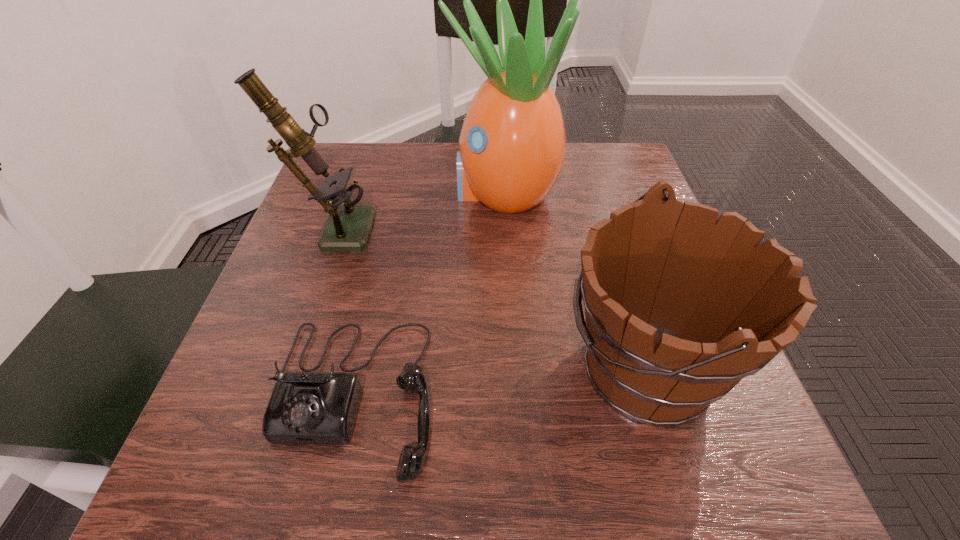
Find the location of a particular element. free spot at the near edge of the desktop is located at coordinates pyautogui.click(x=574, y=458).

In the image, there is a desktop. Identify the location of free region at the left edge. (294, 289).

Identify the location of free space at the right edge of the desktop. click(579, 204).

Find the location of a particular element. The width and height of the screenshot is (960, 540). vacant space at the far left corner of the desktop is located at coordinates (368, 154).

In the image, there is a desktop. What are the coordinates of `free space at the far right corner` in the screenshot? It's located at (645, 191).

You are a GUI agent. You are given a task and a screenshot of the screen. Output one action in this format:
    pyautogui.click(x=<x>, y=<y>)
    Task: Click on the vacant space at the near right corner
    This screenshot has height=540, width=960.
    Given the screenshot: What is the action you would take?
    pyautogui.click(x=718, y=447)

Find the location of `vacant space that is in between the shortest object and the tallest object`. vacant space that is in between the shortest object and the tallest object is located at coordinates (428, 294).

You are a GUI agent. You are given a task and a screenshot of the screen. Output one action in this format:
    pyautogui.click(x=<x>, y=<y>)
    Task: Click on the blank region between the microscope and the tallest object
    The image size is (960, 540).
    Given the screenshot: What is the action you would take?
    pyautogui.click(x=419, y=209)

I want to click on free point between the wine bucket and the shortest object, so click(x=498, y=381).

Where is `vacant point located between the microscope and the wine bucket`? This screenshot has width=960, height=540. vacant point located between the microscope and the wine bucket is located at coordinates (489, 296).